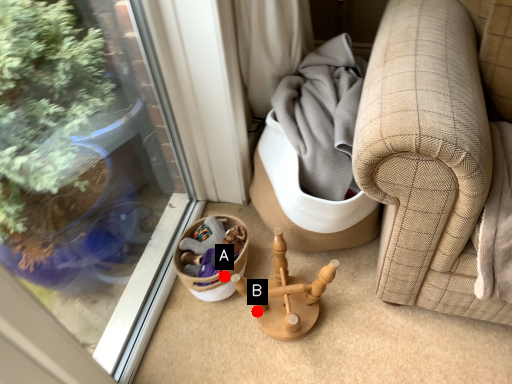
Question: Two points are circled on the image, labeled by A and B beside each circle. Which point appears closest to the camera in this image?

Choices:
 (A) A is closer
 (B) B is closer

Answer: (A)